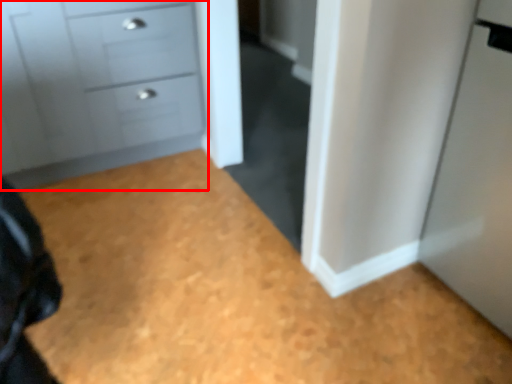
Question: Where is chest of drawers (annotated by the red box) located in relation to plain in the image?

Choices:
 (A) right
 (B) left

Answer: (B)